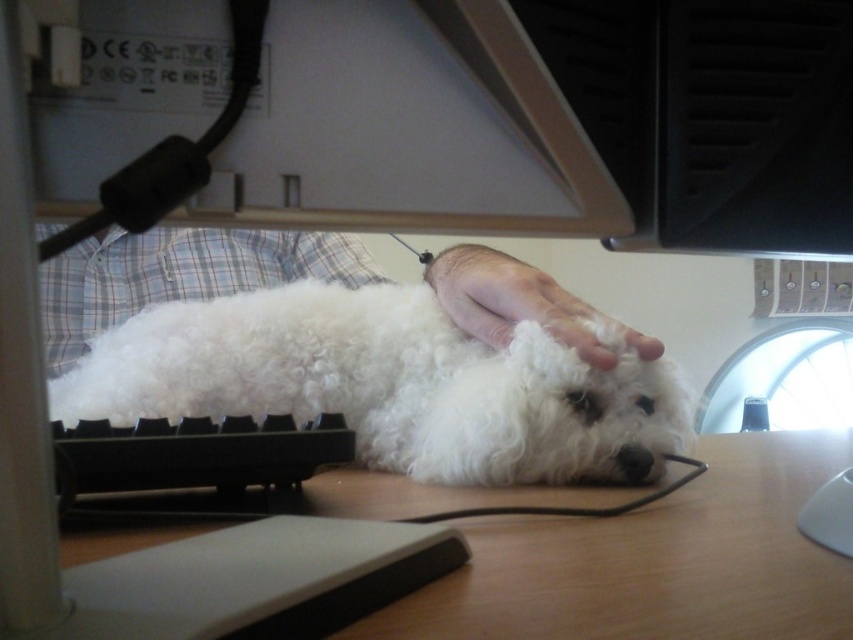
Question: Among these objects, which one is farthest from the camera?

Choices:
 (A) white soft hand at center
 (B) wooden at center

Answer: (A)

Question: Among these points, which one is nearest to the camera?

Choices:
 (A) (817, 624)
 (B) (93, 317)

Answer: (A)

Question: Can you confirm if white curly fur dog at center is smaller than white fluffy dog at center?

Choices:
 (A) yes
 (B) no

Answer: (A)

Question: Observing the image, what is the correct spatial positioning of white curly fur dog at center in reference to wooden at center?

Choices:
 (A) right
 (B) left

Answer: (B)

Question: Which point is farther to the camera?

Choices:
 (A) (490, 269)
 (B) (270, 260)
 (C) (97, 342)
 (D) (624, 573)

Answer: (B)

Question: Does white fluffy dog at center appear under white soft hand at center?

Choices:
 (A) no
 (B) yes

Answer: (B)